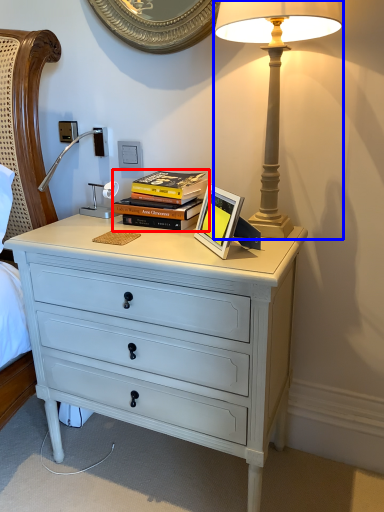
Question: Which of the following is the closest to the observer, book (highlighted by a red box) or lamp (highlighted by a blue box)?

Choices:
 (A) book
 (B) lamp

Answer: (B)